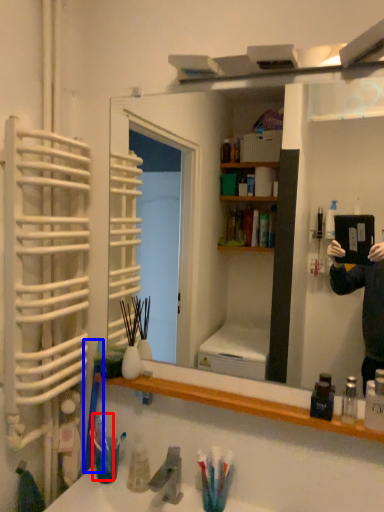
Question: Among these objects, which one is farthest to the camera, toothbrush (highlighted by a red box) or toothbrush (highlighted by a blue box)?

Choices:
 (A) toothbrush
 (B) toothbrush

Answer: (B)